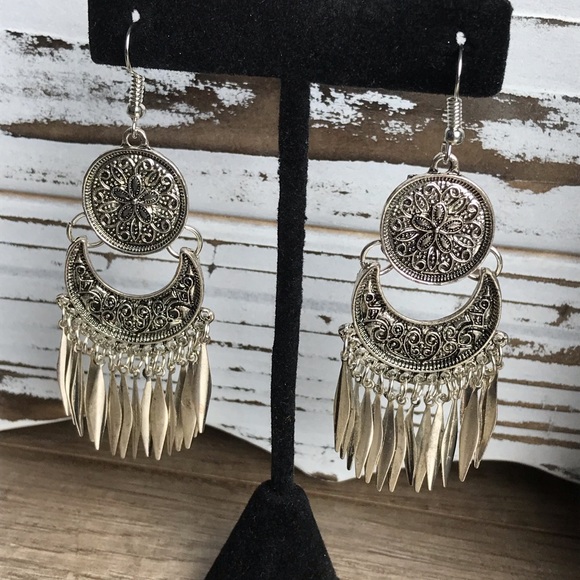
Where is `floor`? The image size is (580, 580). floor is located at coordinates (390, 561).